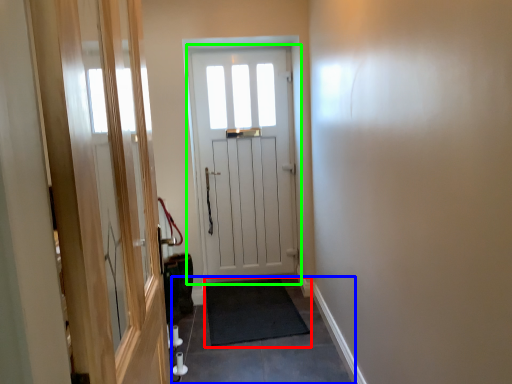
Question: Estimate the real-world distances between objects in this image. Which object is farther from doormat (highlighted by a red box), path (highlighted by a blue box) or door (highlighted by a green box)?

Choices:
 (A) path
 (B) door

Answer: (B)